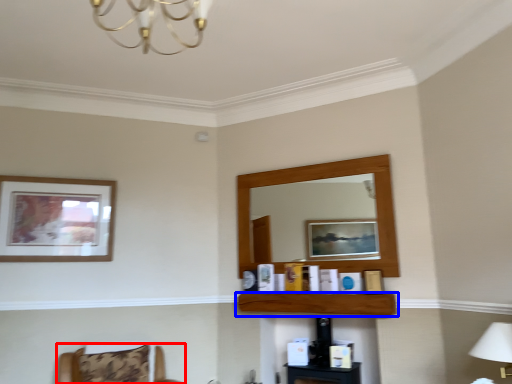
Question: Which object appears closest to the camera in this image, furniture (highlighted by a red box) or shelf (highlighted by a blue box)?

Choices:
 (A) furniture
 (B) shelf

Answer: (A)